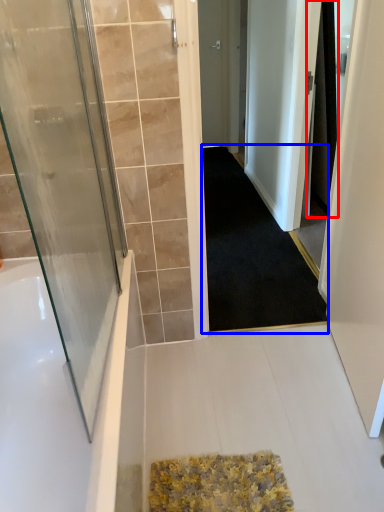
Question: Which object appears farthest to the camera in this image, shower curtain (highlighted by a red box) or doormat (highlighted by a blue box)?

Choices:
 (A) shower curtain
 (B) doormat

Answer: (A)